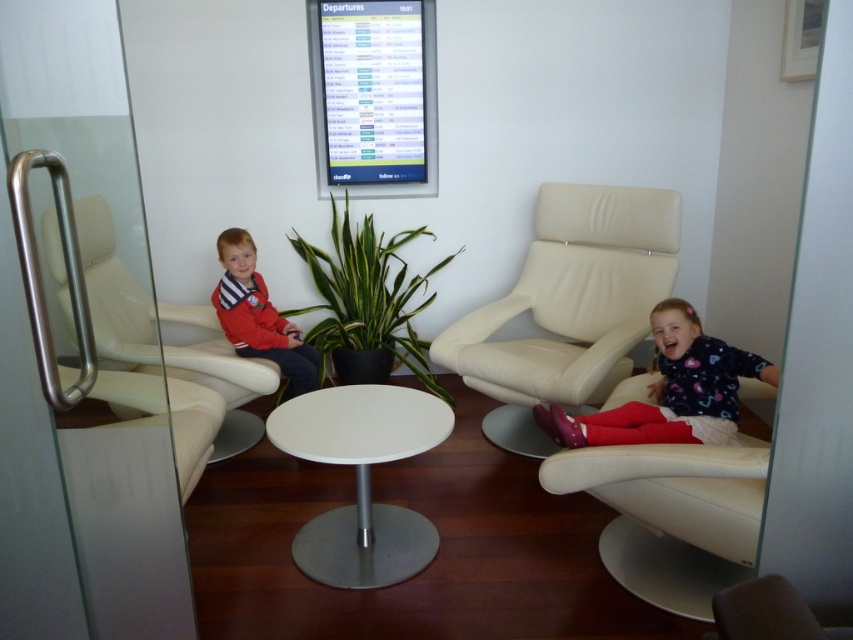
Question: Which object is the closest to the green leafy plant at center?

Choices:
 (A) white glossy table at center
 (B) matte red jacket at left
 (C) white leather armchair at left

Answer: (B)

Question: Considering the relative positions of beige leather chair at right and green leafy plant at center in the image provided, where is beige leather chair at right located with respect to green leafy plant at center?

Choices:
 (A) right
 (B) left

Answer: (A)

Question: Can you confirm if beige leather chair at right is positioned to the right of white leather armchair at left?

Choices:
 (A) yes
 (B) no

Answer: (A)

Question: Which point is farther from the camera taking this photo?

Choices:
 (A) (312, 344)
 (B) (364, 396)
 (C) (294, 326)
 (D) (587, 416)

Answer: (A)

Question: Is matte pink skirt at lower right thinner than matte red jacket at left?

Choices:
 (A) no
 (B) yes

Answer: (A)

Question: Which point is closer to the camera?

Choices:
 (A) (107, 320)
 (B) (575, 420)
 (C) (448, 257)
 (D) (621, 336)

Answer: (A)